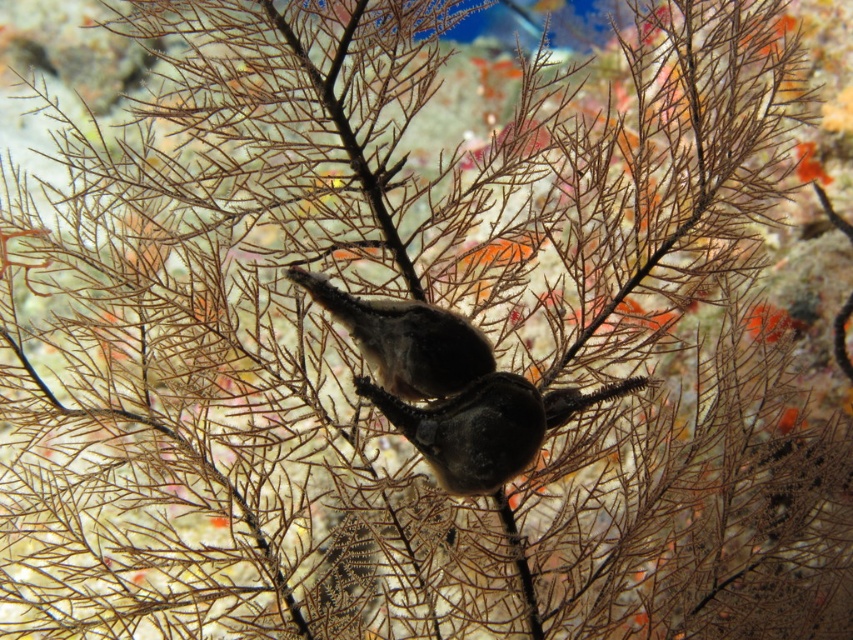
You are a marine biologist observing the sea fan coral. You notice two creatures on it. Which one is larger, the smooth dark gray seahorse at center or the brown textured bird at center?

The smooth dark gray seahorse at center is bigger than the brown textured bird at center according to the description.

You are an underwater photographer aiming to capture both the smooth dark gray seahorse at center and the brown textured bird at center in a single frame. Based on their sizes, which one should you focus on to ensure both fit in the photo without cropping?

The smooth dark gray seahorse at center might be wider than the brown textured bird at center, so focusing on the seahorse would ensure both fit in the photo since it requires more space.